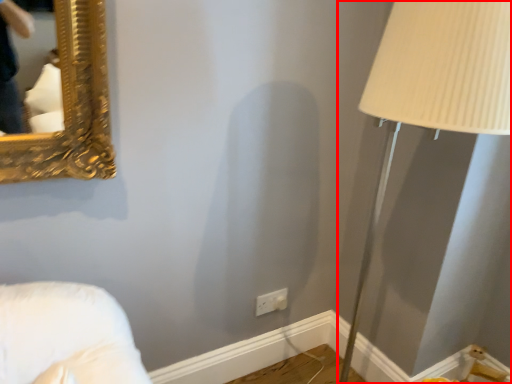
Question: From the image's perspective, considering the relative positions of table lamp (annotated by the red box) and electric outlet in the image provided, where is table lamp (annotated by the red box) located with respect to the staircase?

Choices:
 (A) above
 (B) below

Answer: (A)